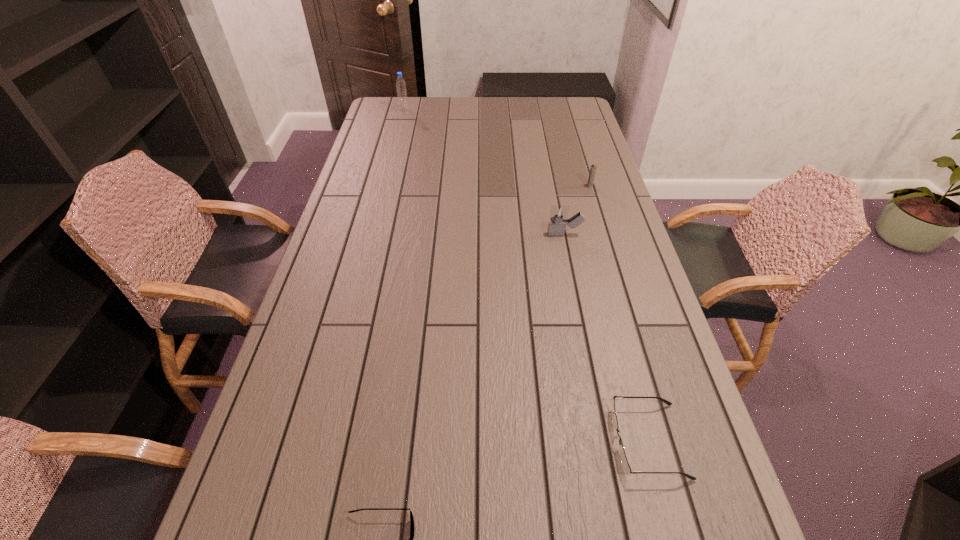
The width and height of the screenshot is (960, 540). What are the coordinates of `free region located on the front of the farther igniter` in the screenshot? It's located at (598, 212).

The image size is (960, 540). I want to click on vacant space located 0.070m on the front-facing side of the farther spectacles, so click(580, 441).

Identify the location of free space located on the front-facing side of the farther spectacles. (492, 441).

Identify the location of free space located 0.160m on the front-facing side of the farther spectacles. The image size is (960, 540). (536, 441).

Where is `object present at the far edge`? object present at the far edge is located at coordinates coord(400,83).

This screenshot has height=540, width=960. What are the coordinates of `object located in the left edge section of the desktop` in the screenshot? It's located at (400, 83).

The width and height of the screenshot is (960, 540). Identify the location of spectacles at the right edge. (627, 469).

Image resolution: width=960 pixels, height=540 pixels. Find the location of `object that is at the far left corner`. object that is at the far left corner is located at coordinates (400, 83).

You are a GUI agent. You are given a task and a screenshot of the screen. Output one action in this format:
    pyautogui.click(x=<x>, y=<y>)
    Task: Click on the vacant space at the far edge of the desktop
    The height and width of the screenshot is (540, 960).
    Given the screenshot: What is the action you would take?
    [x=512, y=104]

In the image, there is a desktop. Identify the location of vacant space at the left edge. The height and width of the screenshot is (540, 960). (315, 422).